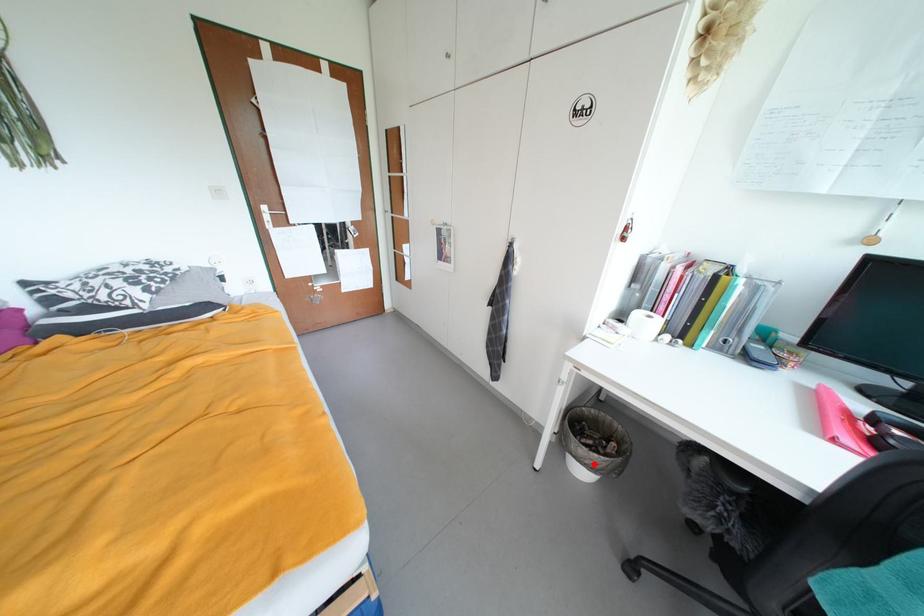
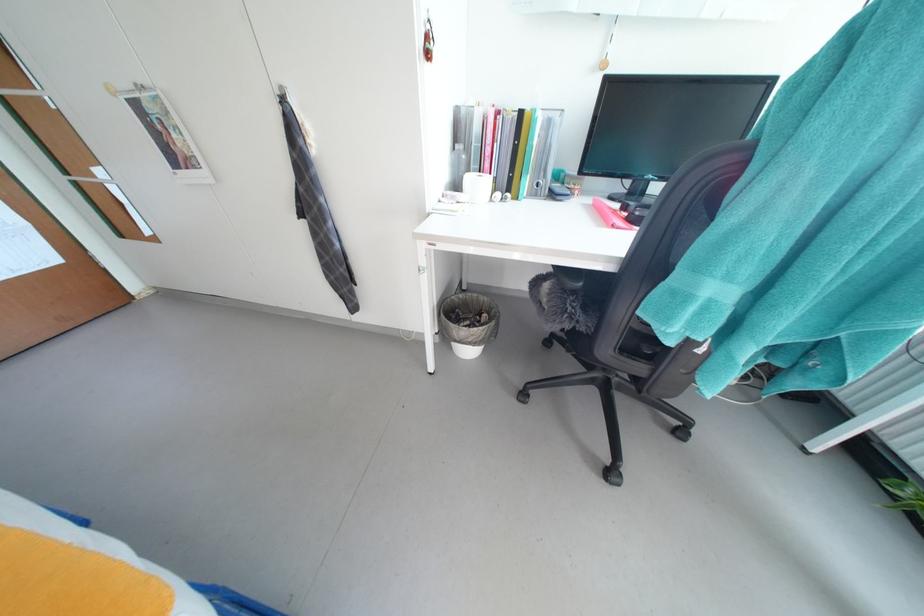
Question: I am providing you with two images of the same scene from different viewpoints. A red point is shown in image1. For the corresponding object point in image2, is it positioned nearer or farther from the camera?

Choices:
 (A) Nearer
 (B) Farther

Answer: (B)